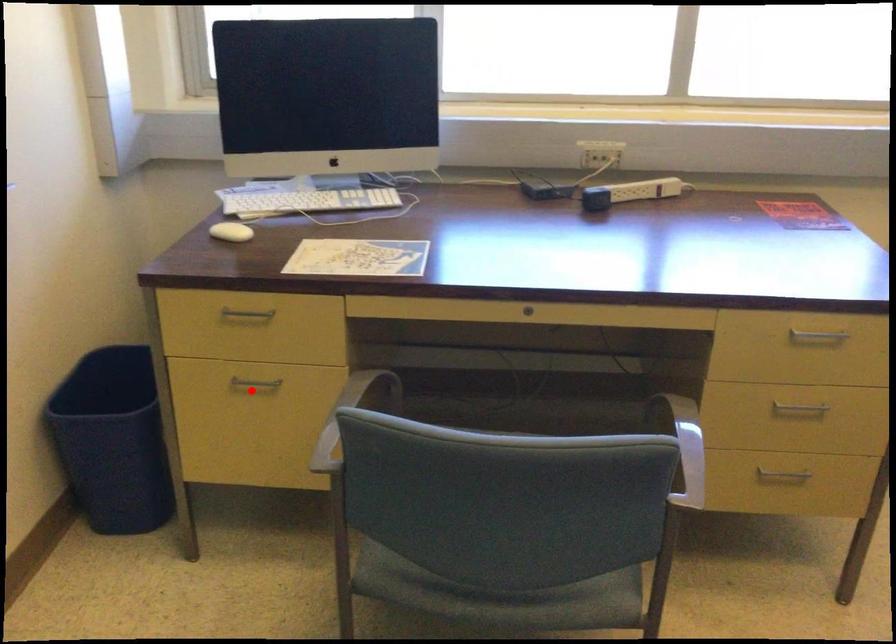
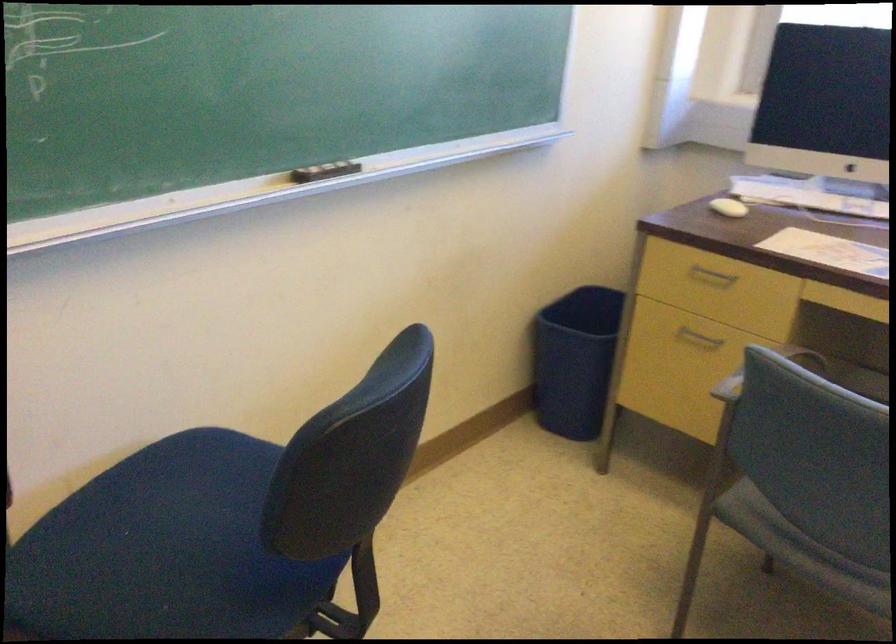
The point at the highlighted location is marked in the first image. Where is the corresponding point in the second image?

(698, 337)